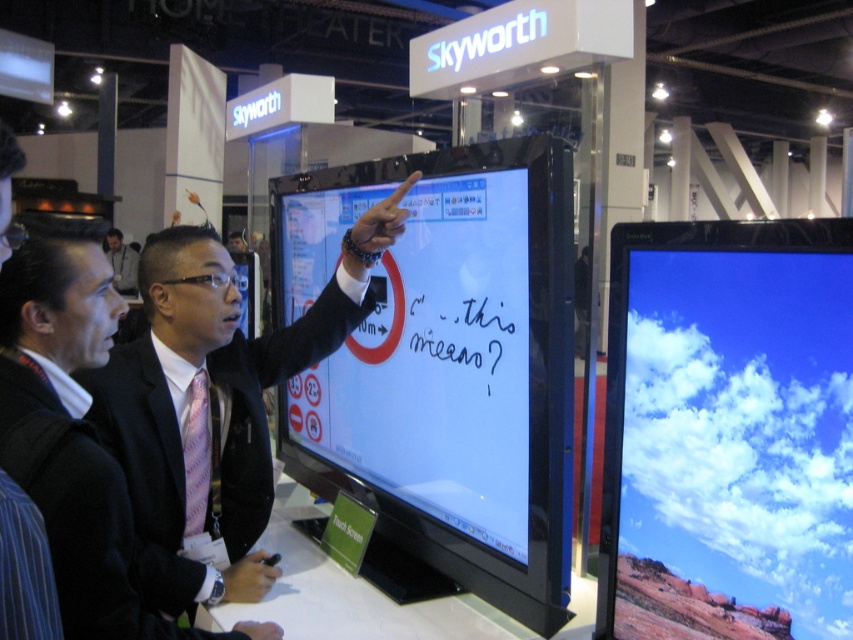
Question: Which object appears closest to the camera in this image?

Choices:
 (A) light brown leather jacket at center
 (B) matte black touch screen at center
 (C) matte glass monitor at right
 (D) matte black suit at center

Answer: (C)

Question: Which of the following is the closest to the observer?

Choices:
 (A) matte black touch screen at center
 (B) light brown leather jacket at center
 (C) matte glass monitor at right
 (D) pink striped fabric suit at center

Answer: (C)

Question: Does matte glass monitor at right have a larger size compared to matte black suit at center?

Choices:
 (A) yes
 (B) no

Answer: (B)

Question: Can you confirm if matte black touch screen at center is positioned to the left of light brown leather jacket at center?

Choices:
 (A) no
 (B) yes

Answer: (A)

Question: Estimate the real-world distances between objects in this image. Which object is farther from the light brown leather jacket at center?

Choices:
 (A) matte black suit at center
 (B) pink striped fabric suit at center
 (C) matte black touch screen at center
 (D) matte glass monitor at right

Answer: (D)

Question: In this image, where is matte glass monitor at right located relative to matte black suit at center?

Choices:
 (A) left
 (B) right

Answer: (B)